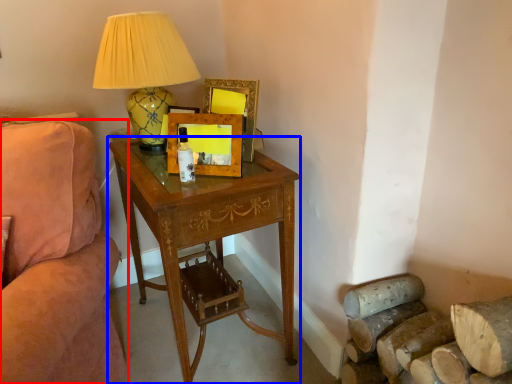
Question: Which point is closer to the camera, studio couch (highlighted by a red box) or desk (highlighted by a blue box)?

Choices:
 (A) studio couch
 (B) desk

Answer: (A)